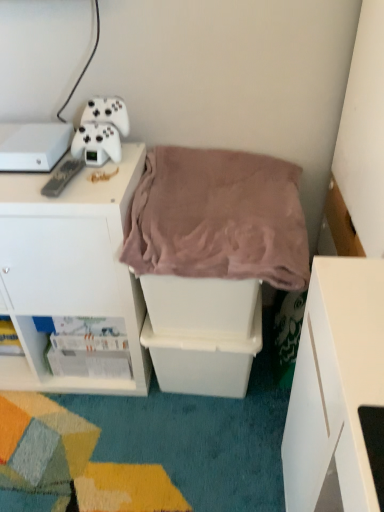
Find the location of a particular element. vacant area that is in front of white matte game controller at upper left is located at coordinates point(98,179).